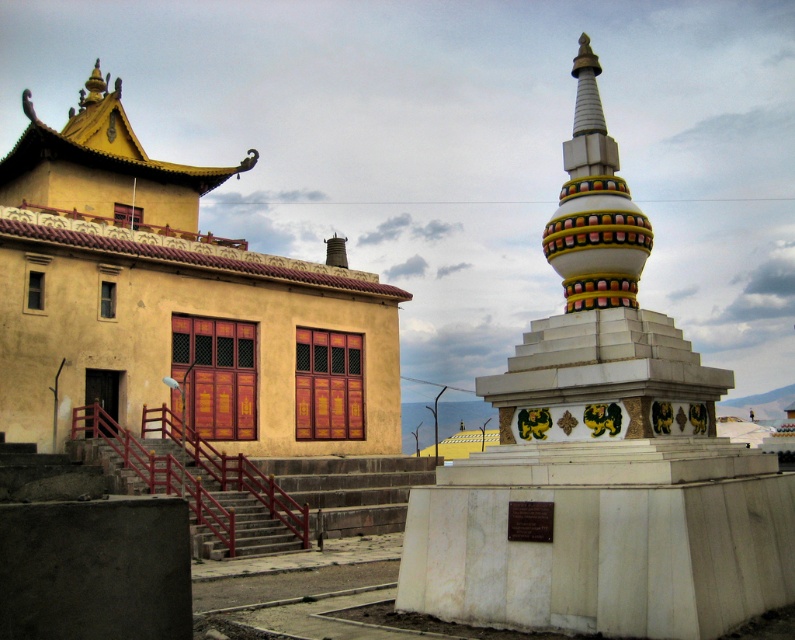
You are a visitor at the temple complex and want to take a photo of the white glossy stupa at center without the metallic red stairs at center blocking the view. Is it possible to find a position where the stupa is visible but the stairs are not?

The white glossy stupa at center is behind the metallic red stairs at center, so if you move to a position where you can see behind the stairs, the stupa will be visible without the stairs blocking it.

You are standing at point A located at coordinates point (584, 264) and want to move towards point B located at coordinates point (103, 472). Based on the scene description, will point B be visible from your current position?

Point (103, 472) is behind point (584, 264), so it will not be visible from your current position at point (584, 264).

You are an architect planning to install a new pathway between the metallic red stairs at center and the white glossy stupa at center. Given that the pathway must be wide enough to accommodate a 2.5 meter wide truck, can the space between them accommodate this requirement?

The metallic red stairs at center is wider than the white glossy stupa at center, but the description does not provide exact measurements of their widths or the space between them. Therefore, it is unclear if the pathway between them can accommodate a 2.5 meter wide truck.